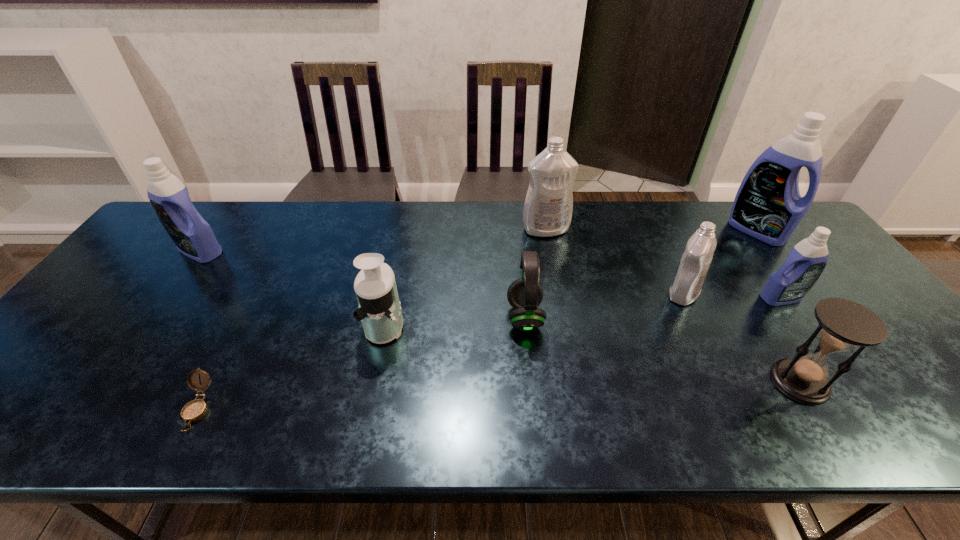
Image resolution: width=960 pixels, height=540 pixels. I want to click on free point at the near edge, so click(328, 438).

You are a GUI agent. You are given a task and a screenshot of the screen. Output one action in this format:
    pyautogui.click(x=<x>, y=<y>)
    Task: Click on the vacant area at the left edge
    The image size is (960, 540).
    Given the screenshot: What is the action you would take?
    pyautogui.click(x=91, y=313)

Identify the location of vacant area at the right edge of the desktop. (866, 302).

At what (x,y) coordinates should I click in order to perform the action: click on vacant space that's between the third object from left to right and the bigger white detergent. Please return your answer as a coordinate pair (x, y). This screenshot has width=960, height=540. Looking at the image, I should click on (466, 277).

Locate an element on the screen. This screenshot has height=540, width=960. vacant area that lies between the smaller white detergent and the leftmost object is located at coordinates click(442, 272).

Locate an element on the screen. empty space that is in between the eighth object from right to left and the right white detergent is located at coordinates (441, 351).

At what (x,y) coordinates should I click in order to perform the action: click on free point between the farther white detergent and the tallest object. Please return your answer as a coordinate pair (x, y). The height and width of the screenshot is (540, 960). Looking at the image, I should click on (651, 230).

Where is `vacant area between the smallest blue detergent and the black hourglass`? This screenshot has width=960, height=540. vacant area between the smallest blue detergent and the black hourglass is located at coordinates (790, 340).

This screenshot has width=960, height=540. I want to click on vacant point located between the biggest blue detergent and the left white detergent, so click(x=651, y=230).

Locate an element on the screen. unoccupied position between the black hourglass and the smallest blue detergent is located at coordinates (790, 340).